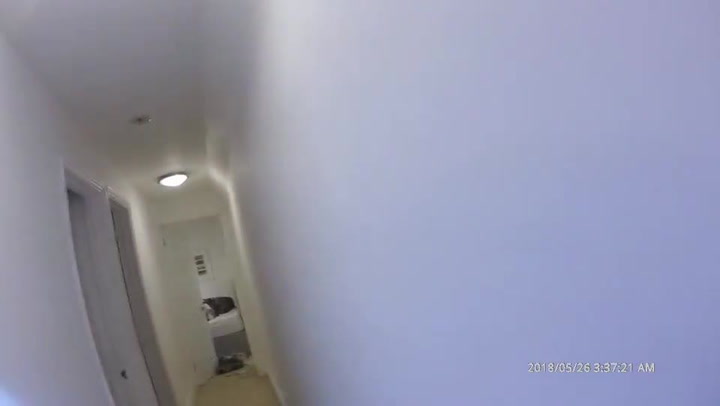
At what (x,y) coordinates should I click in order to perform the action: click on part under the mattress. Please return your answer as a coordinate pair (x, y). The height and width of the screenshot is (406, 720). Looking at the image, I should click on (235, 343).